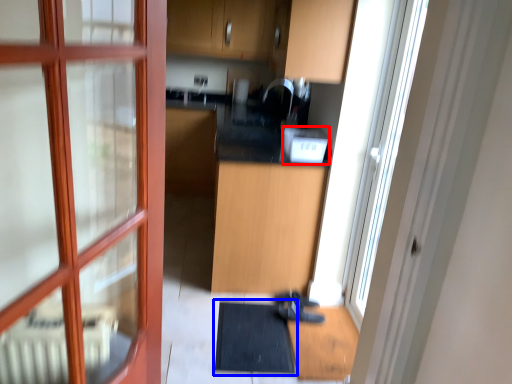
Question: Which object is closer to the camera taking this photo, appliance (highlighted by a red box) or bath mat (highlighted by a blue box)?

Choices:
 (A) appliance
 (B) bath mat

Answer: (B)